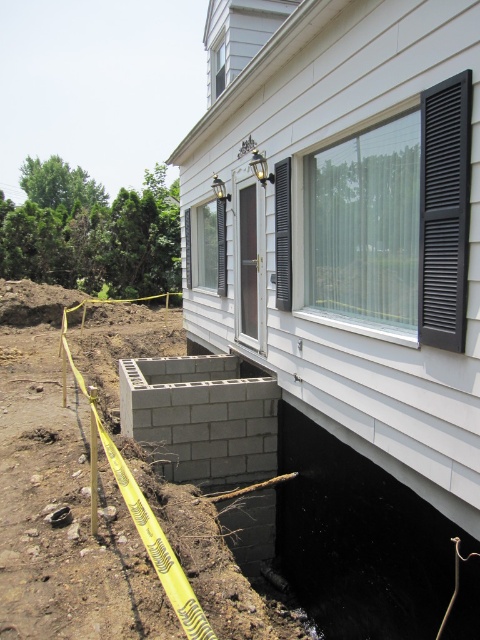
Question: Among these points, which one is farthest from the camera?

Choices:
 (A) (56, 438)
 (B) (188, 337)

Answer: (B)

Question: Does white siding at center come behind dirt/soil at lower left?

Choices:
 (A) no
 (B) yes

Answer: (A)

Question: Does white siding at center appear on the left side of gray concrete block at lower center?

Choices:
 (A) yes
 (B) no

Answer: (B)

Question: From the image, what is the correct spatial relationship of white siding at center in relation to dirt/soil at lower left?

Choices:
 (A) left
 (B) right

Answer: (B)

Question: Which object appears farthest from the camera in this image?

Choices:
 (A) gray concrete block at lower center
 (B) white siding at center
 (C) dirt/soil at lower left

Answer: (C)

Question: Which of the following is the closest to the observer?

Choices:
 (A) (430, 72)
 (B) (239, 477)
 (C) (41, 438)

Answer: (A)